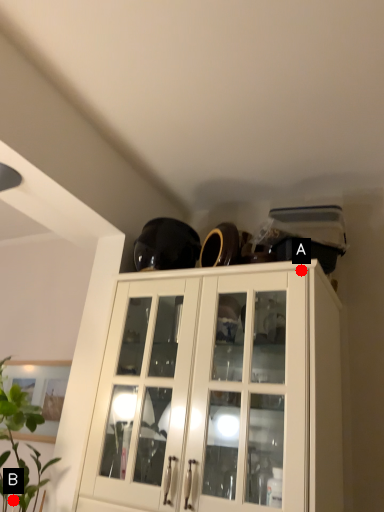
Question: Two points are circled on the image, labeled by A and B beside each circle. Which point is closer to the camera?

Choices:
 (A) A is closer
 (B) B is closer

Answer: (B)